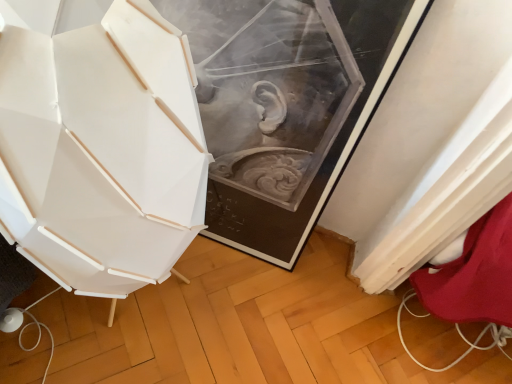
Describe the element at coordinates (101, 150) in the screenshot. I see `white matte geometric lamp at left` at that location.

Find the location of `white matte geometric lamp at left`. white matte geometric lamp at left is located at coordinates (101, 150).

Locate an element on the screen. The height and width of the screenshot is (384, 512). white matte geometric lamp at left is located at coordinates (101, 150).